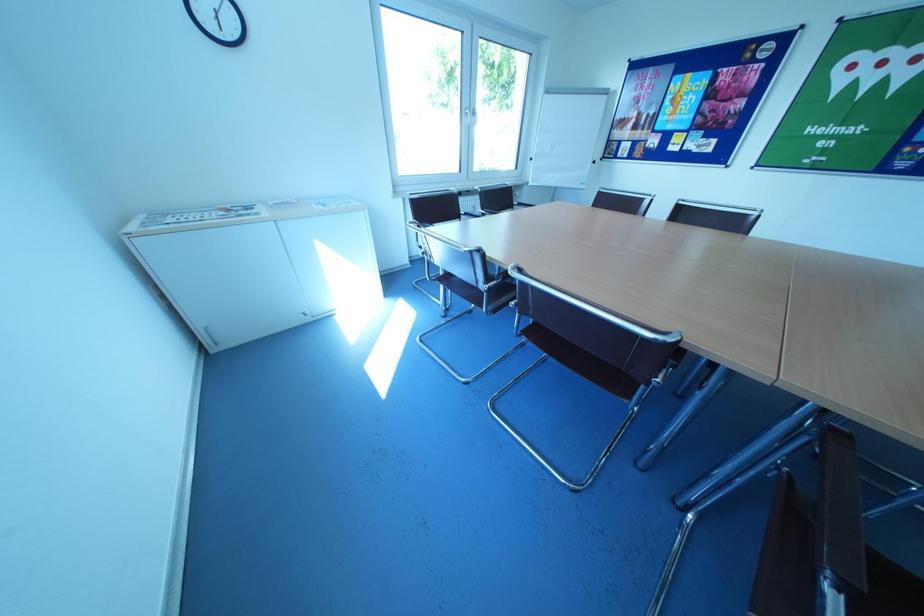
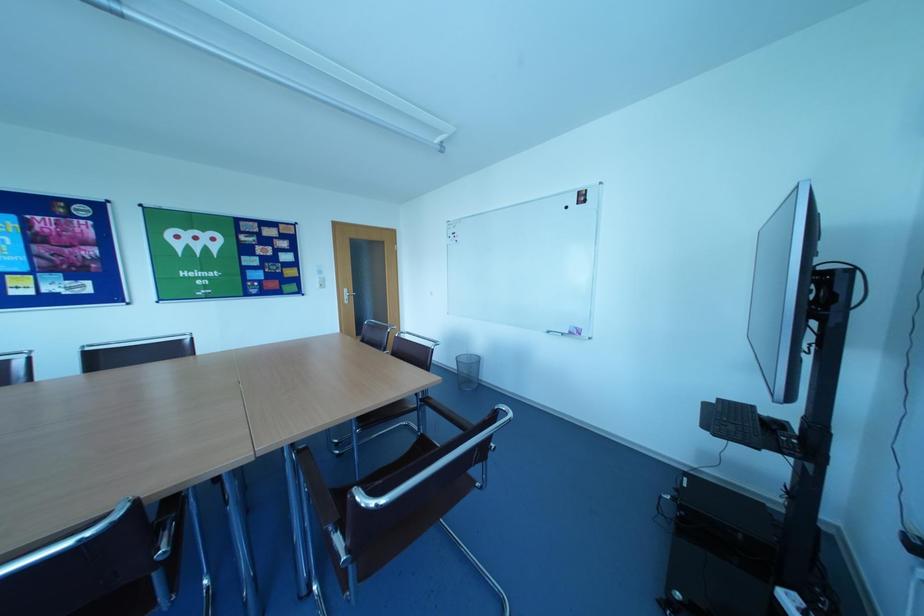
Question: How did the camera likely rotate?

Choices:
 (A) Left
 (B) Right
 (C) Up
 (D) Down

Answer: (B)